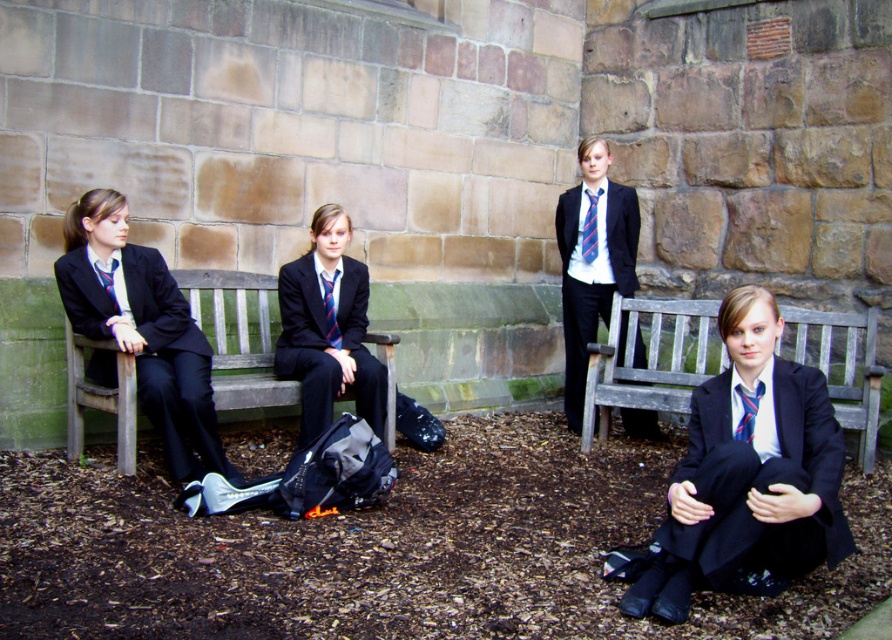
Question: Considering the real-world distances, which object is farthest from the matte blue tie at left?

Choices:
 (A) blue striped tie at center
 (B) wooden park bench at lower right

Answer: (B)

Question: In this image, where is matte black blazer at left located relative to green wooden bench at left?

Choices:
 (A) above
 (B) below

Answer: (B)

Question: Is green wooden bench at left below matte blue tie at left?

Choices:
 (A) no
 (B) yes

Answer: (B)

Question: Which object is the farthest from the matte black blazer at center?

Choices:
 (A) wooden park bench at lower right
 (B) green wooden bench at left

Answer: (B)

Question: Can you confirm if matte black blazer at center is thinner than striped fabric tie at center?

Choices:
 (A) no
 (B) yes

Answer: (A)

Question: Estimate the real-world distances between objects in this image. Which object is farther from the striped fabric tie at center?

Choices:
 (A) blue striped tie at center
 (B) matte black blazer at left

Answer: (A)